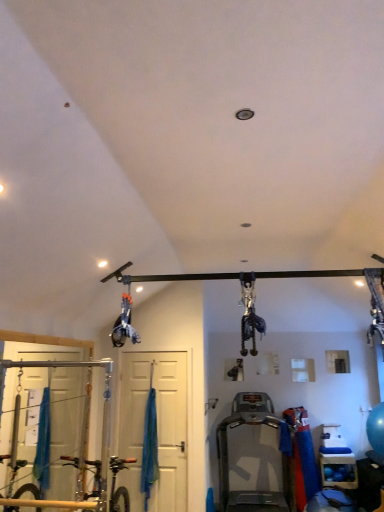
Locate an element on the screen. Image resolution: width=384 pixels, height=512 pixels. silver metallic treadmill at center is located at coordinates (228, 458).

The height and width of the screenshot is (512, 384). What are the coordinates of `blue fabric curtain at center` in the screenshot? It's located at (150, 444).

You are a GUI agent. You are given a task and a screenshot of the screen. Output one action in this format:
    pyautogui.click(x=<x>, y=<y>)
    Task: Click on the white matte door at center
    
    Given the screenshot: What is the action you would take?
    pyautogui.click(x=157, y=426)

Is point (276, 497) positioned behind point (151, 476)?

Yes.

Is silver metallic treadmill at center positioned far away from blue fabric curtain at center?

A: Absolutely, silver metallic treadmill at center is distant from blue fabric curtain at center.

Considering the relative sizes of silver metallic treadmill at center and blue fabric curtain at center in the image provided, is silver metallic treadmill at center smaller than blue fabric curtain at center?

No, silver metallic treadmill at center is not smaller than blue fabric curtain at center.

Does silver metallic treadmill at center have a lesser width compared to blue fabric curtain at center?

In fact, silver metallic treadmill at center might be wider than blue fabric curtain at center.

From the image's perspective, which is above, white matte door at center or silver metallic treadmill at center?

white matte door at center, from the image's perspective.

Is white matte door at center with silver metallic treadmill at center?

white matte door at center and silver metallic treadmill at center are clearly separated.

Which of these two, white matte door at center or silver metallic treadmill at center, stands shorter?

Standing shorter between the two is silver metallic treadmill at center.

Is point (165, 454) positioned behind point (321, 472)?

That is False.

Looking at this image, considering the sizes of white matte door at center and blue rubber balls at lower right in the image, is white matte door at center taller or shorter than blue rubber balls at lower right?

white matte door at center is taller than blue rubber balls at lower right.

Based on the photo, can you confirm if white matte door at center is positioned to the left of blue rubber balls at lower right?

Correct, you'll find white matte door at center to the left of blue rubber balls at lower right.

Is white matte door at center facing away from blue rubber balls at lower right?

No, white matte door at center is not facing away from blue rubber balls at lower right.

From the image's perspective, is blue rubber balls at lower right on blue fabric curtain at center?

Incorrect, from the image's perspective, blue rubber balls at lower right is lower than blue fabric curtain at center.

From the picture: Can you tell me how much blue rubber balls at lower right and blue fabric curtain at center differ in facing direction?

The angle between the facing direction of blue rubber balls at lower right and the facing direction of blue fabric curtain at center is 1.65 degrees.

Can you confirm if blue rubber balls at lower right is smaller than blue fabric curtain at center?

Incorrect, blue rubber balls at lower right is not smaller in size than blue fabric curtain at center.

Based on the photo, does blue rubber balls at lower right lie in front of blue fabric curtain at center?

That is False.

From the image's perspective, is silver metallic treadmill at center located above or below white matte door at center?

Based on their image positions, silver metallic treadmill at center is located beneath white matte door at center.

Based on their sizes in the image, would you say silver metallic treadmill at center is bigger or smaller than white matte door at center?

In the image, silver metallic treadmill at center appears to be larger than white matte door at center.

Is silver metallic treadmill at center next to white matte door at center?

silver metallic treadmill at center and white matte door at center are clearly separated.

Consider the image. Can you confirm if silver metallic treadmill at center is wider than white matte door at center?

Correct, the width of silver metallic treadmill at center exceeds that of white matte door at center.

Does blue rubber balls at lower right have a greater height compared to white matte door at center?

No, blue rubber balls at lower right is not taller than white matte door at center.

Considering the positions of point (341, 471) and point (173, 409), is point (341, 471) closer or farther from the camera than point (173, 409)?

Point (341, 471).

From a real-world perspective, is blue rubber balls at lower right beneath white matte door at center?

Yes, from a real-world perspective, blue rubber balls at lower right is below white matte door at center.

Is blue fabric curtain at center directly adjacent to silver metallic treadmill at center?

No, blue fabric curtain at center is not next to silver metallic treadmill at center.

Which of these two, blue fabric curtain at center or silver metallic treadmill at center, is wider?

silver metallic treadmill at center.

Between blue fabric curtain at center and silver metallic treadmill at center, which one appears on the right side from the viewer's perspective?

From the viewer's perspective, silver metallic treadmill at center appears more on the right side.

In the image, there is a silver metallic treadmill at center. Identify the location of curtain above it (from the image's perspective). Image resolution: width=384 pixels, height=512 pixels. (150, 444).

This screenshot has width=384, height=512. Identify the location of treadmill located underneath the white matte door at center (from a real-world perspective). (228, 458).

From the image, which object appears to be farther from white matte door at center, blue rubber balls at lower right or blue fabric curtain at center?

blue rubber balls at lower right.

Estimate the real-world distances between objects in this image. Which object is further from silver metallic treadmill at center, white matte door at center or blue rubber balls at lower right?

white matte door at center is further to silver metallic treadmill at center.

From the image, which object appears to be farther from blue rubber balls at lower right, blue fabric curtain at center or white matte door at center?

blue fabric curtain at center.

Based on their spatial positions, is silver metallic treadmill at center or blue fabric curtain at center further from white matte door at center?

silver metallic treadmill at center lies further to white matte door at center than the other object.

Looking at the image, which one is located closer to silver metallic treadmill at center, blue rubber balls at lower right or blue fabric curtain at center?

Based on the image, blue rubber balls at lower right appears to be nearer to silver metallic treadmill at center.

Estimate the real-world distances between objects in this image. Which object is closer to blue rubber balls at lower right, silver metallic treadmill at center or blue fabric curtain at center?

Based on the image, silver metallic treadmill at center appears to be nearer to blue rubber balls at lower right.

Based on their spatial positions, is blue fabric curtain at center or white matte door at center further from silver metallic treadmill at center?

blue fabric curtain at center is positioned further to the anchor silver metallic treadmill at center.

Estimate the real-world distances between objects in this image. Which object is closer to blue rubber balls at lower right, silver metallic treadmill at center or white matte door at center?

Among the two, silver metallic treadmill at center is located nearer to blue rubber balls at lower right.

Locate an element on the screen. treadmill between white matte door at center and blue rubber balls at lower right from left to right is located at coordinates (228, 458).

The width and height of the screenshot is (384, 512). In order to click on treadmill between blue fabric curtain at center and blue rubber balls at lower right in this screenshot , I will do `click(228, 458)`.

This screenshot has height=512, width=384. What are the coordinates of `door between blue fabric curtain at center and silver metallic treadmill at center` in the screenshot? It's located at (157, 426).

Locate an element on the screen. door located between blue fabric curtain at center and blue rubber balls at lower right in the left-right direction is located at coordinates tap(157, 426).